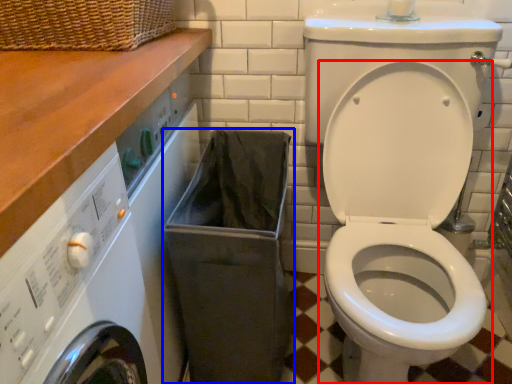
Question: Which object appears farthest to the camera in this image, toilet (highlighted by a red box) or laundry basket (highlighted by a blue box)?

Choices:
 (A) toilet
 (B) laundry basket

Answer: (B)